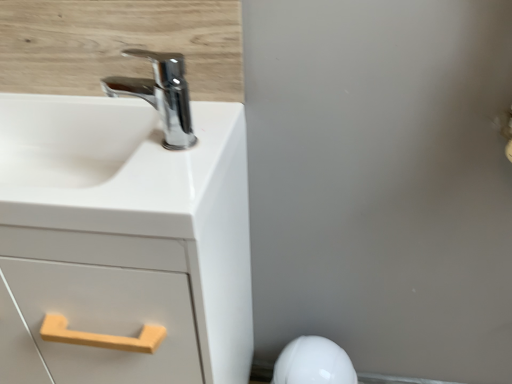
Question: Considering the positions of chrome/metallic faucet at upper left and white matte cabinet at left in the image, is chrome/metallic faucet at upper left wider or thinner than white matte cabinet at left?

Choices:
 (A) thin
 (B) wide

Answer: (A)

Question: Is chrome/metallic faucet at upper left bigger or smaller than white matte cabinet at left?

Choices:
 (A) big
 (B) small

Answer: (B)

Question: Which is nearer to the white glossy sink at upper left?

Choices:
 (A) white glossy porcelain at lower right
 (B) white matte cabinet at left
 (C) chrome/metallic faucet at upper left

Answer: (B)

Question: Estimate the real-world distances between objects in this image. Which object is farther from the white glossy sink at upper left?

Choices:
 (A) white glossy porcelain at lower right
 (B) chrome/metallic faucet at upper left
 (C) white matte cabinet at left

Answer: (A)